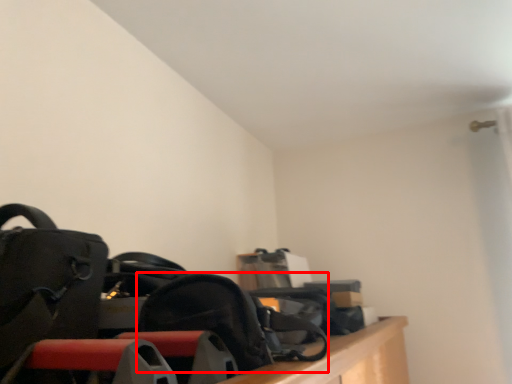
Question: From the image's perspective, considering the relative positions of shoulder bag (annotated by the red box) and luggage and bags in the image provided, where is shoulder bag (annotated by the red box) located with respect to the staircase?

Choices:
 (A) above
 (B) below

Answer: (B)